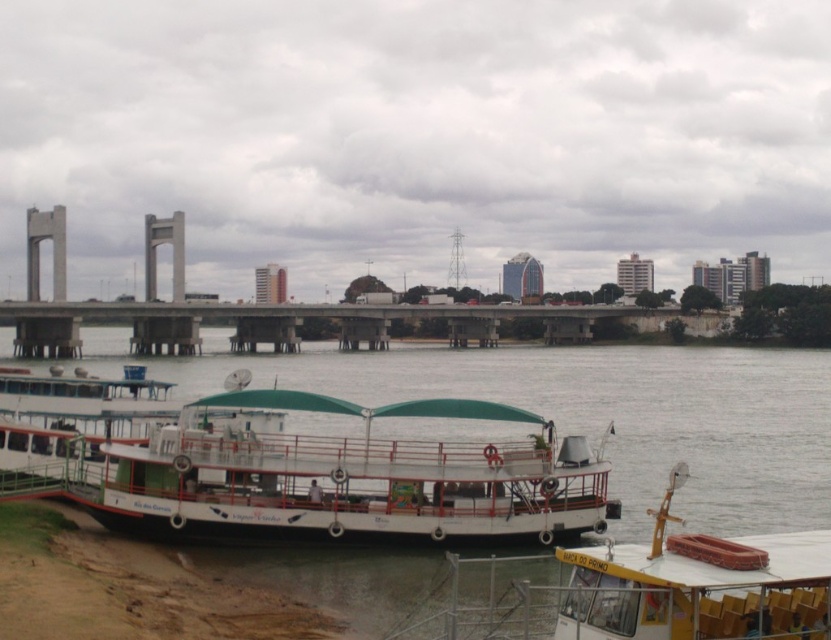
You are a visitor standing on the riverside and want to take a photo of the white matte boat at lower left and the yellow plastic chairs at lower right. Which object should you position closer to the front of your photo frame?

You should position the white matte boat at lower left closer to the front of your photo frame because the yellow plastic chairs at lower right are behind it, meaning the boat is in front.

You are planning to host a small gathering and need to know if the yellow plastic chairs at lower right can fit along the length of the concrete dock at center. Based on the scene, can they be placed there?

The yellow plastic chairs at lower right are narrower than the concrete dock at center, so they can fit along its length.